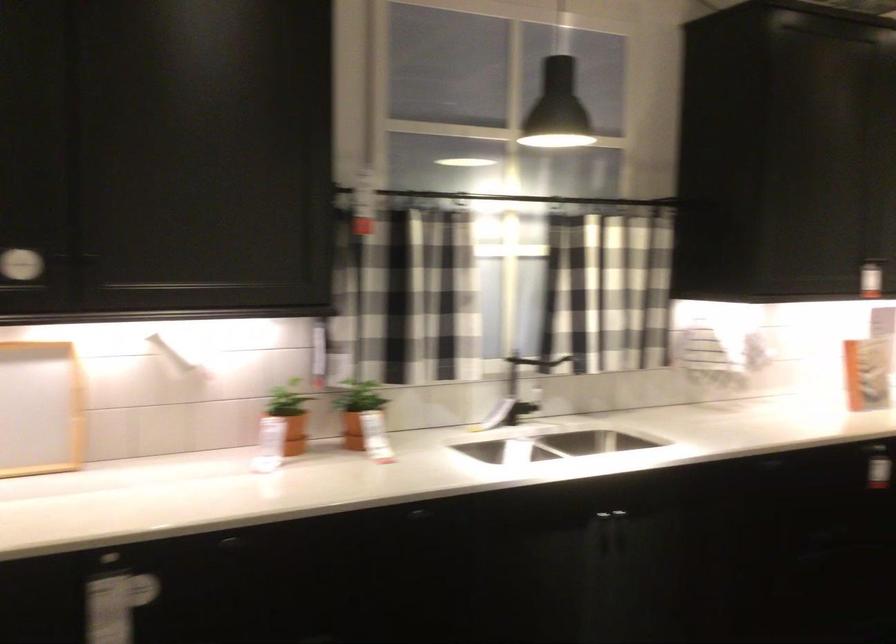
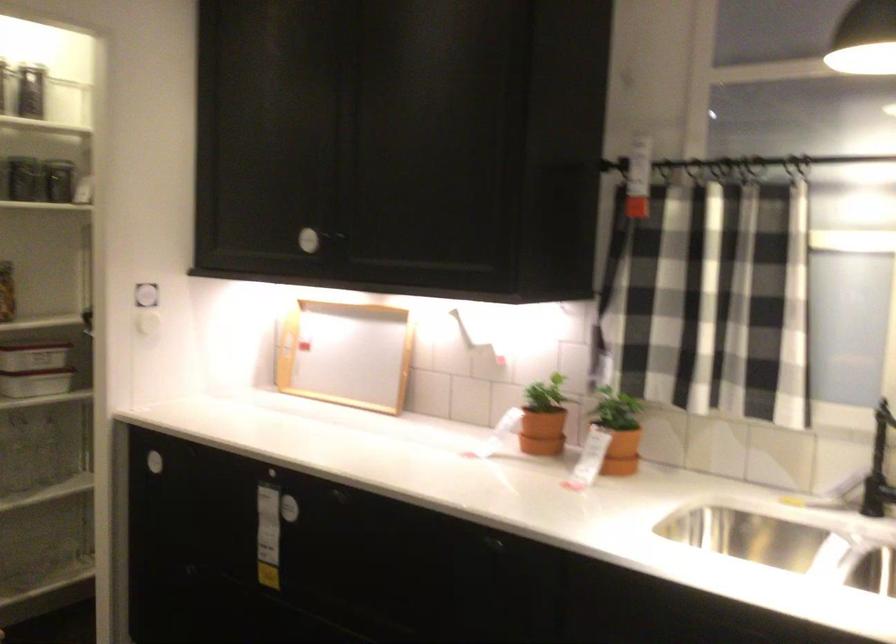
Locate, in the second image, the point that corresponds to (151,571) in the first image.

(306, 500)